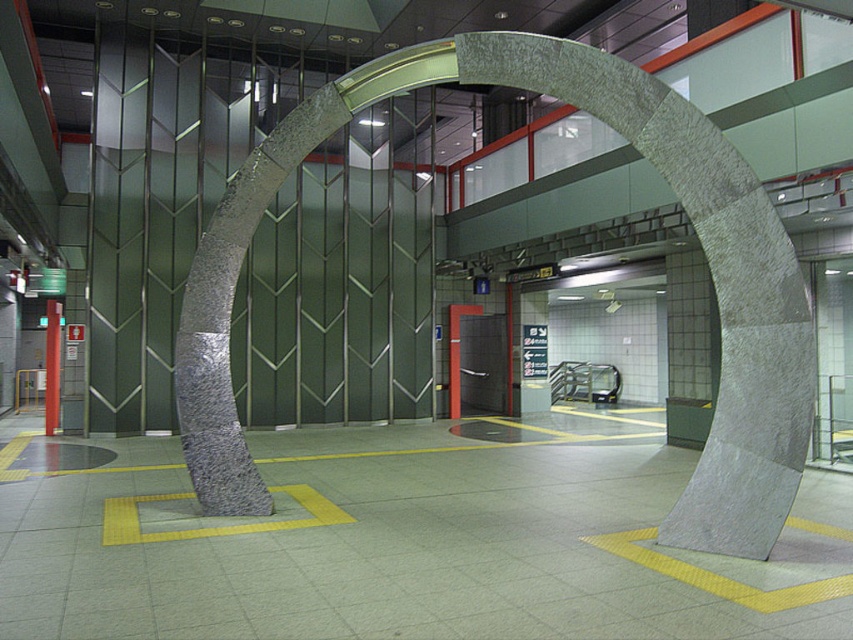
You are a maintenance worker in a subway station. You need to inspect both the gray stone arch at center and the metallic pole at left. According to the image, which object is closer to the left side of the station? Please base your answer on the spatial arrangement shown.

The metallic pole at left is closer to the left side of the station because the gray stone arch at center is positioned on the right side of it.

You are standing in a modern subway station and see the gray stone arch at center. If you want to touch it, how many steps do you need to take if each step is 0.75 meters?

The gray stone arch at center is 5.87 meters away from the viewer. Dividing the distance by the step length gives 5.87 divided by 0.75, which equals approximately 7.83 steps. Since you can only take whole steps, you would need to take 8 steps to reach the gray stone arch at center.

From the picture: You are standing in the subway station and see the gray stone arch at center. Can you tell me where the point at coordinate (x=679, y=202) is located?

The point at coordinate (x=679, y=202) is located on the gray stone arch at center.